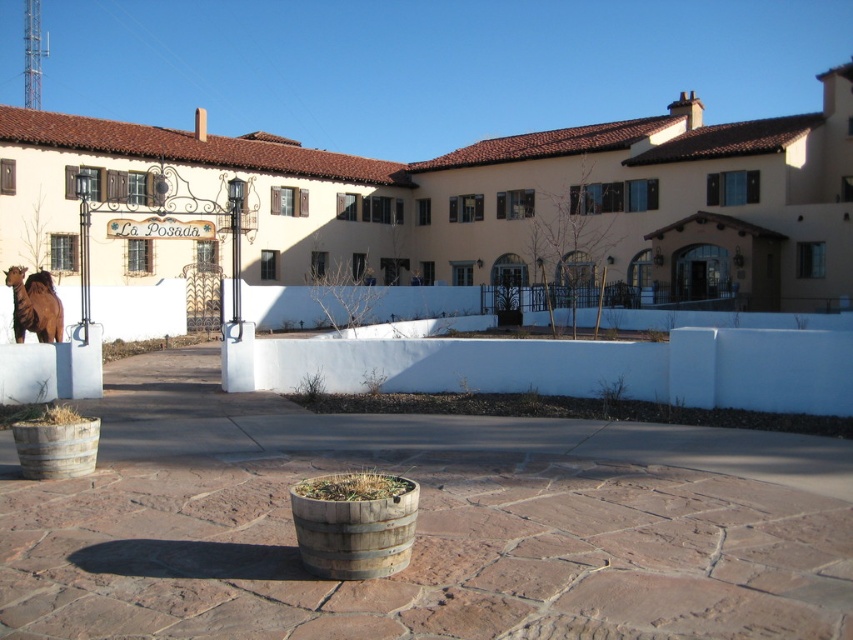
Measure the distance between rustic wood barrel at center and camera.

rustic wood barrel at center is 14.58 feet from camera.

Which is in front, point (370, 541) or point (78, 440)?

Positioned in front is point (370, 541).

Where is `rustic wood barrel at center`? This screenshot has width=853, height=640. rustic wood barrel at center is located at coordinates (354, 524).

Does brown wooden hay at center appear on the left side of brown straw at lower left?

Incorrect, brown wooden hay at center is not on the left side of brown straw at lower left.

The height and width of the screenshot is (640, 853). I want to click on brown wooden hay at center, so click(352, 486).

Is point (57, 323) farther from viewer compared to point (337, 497)?

Yes.

The height and width of the screenshot is (640, 853). Find the location of `brown matte camel at left`. brown matte camel at left is located at coordinates (x=33, y=305).